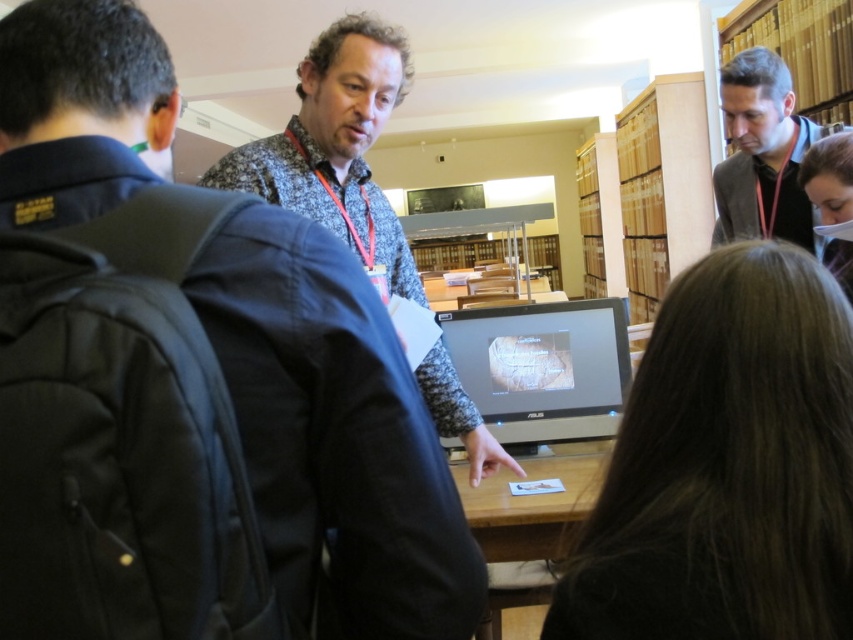
What are the coordinates of the speckled fabric shirt at center in the image?

The coordinates of the speckled fabric shirt at center are at point (337, 145).

What are the coordinates of the speckled fabric shirt at center?

The coordinates of the speckled fabric shirt at center are at point [337,145].

You are standing in the library and see the speckled fabric shirt at center and the wooden table at center. Which object is taller?

The speckled fabric shirt at center is much taller than the wooden table at center.